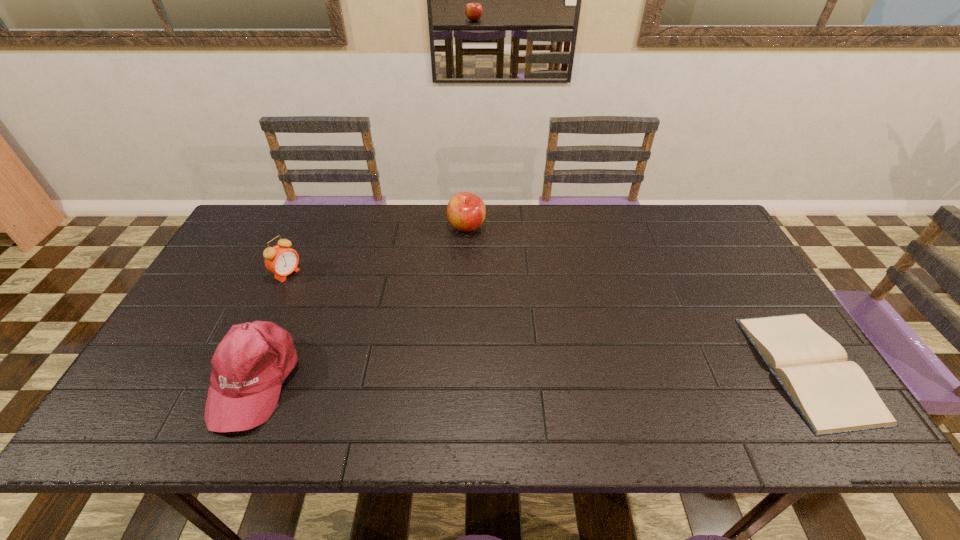
Find the location of a particular element. This screenshot has width=960, height=540. baseball cap is located at coordinates (249, 365).

Locate an element on the screen. The height and width of the screenshot is (540, 960). the rightmost object is located at coordinates (833, 395).

The height and width of the screenshot is (540, 960). I want to click on Bible, so click(x=833, y=395).

The image size is (960, 540). In order to click on the farthest object in this screenshot , I will do `click(466, 212)`.

I want to click on the second object from right to left, so click(x=466, y=212).

Locate an element on the screen. alarm clock is located at coordinates (281, 260).

Find the location of a particular element. free space located 0.180m on the left of the Bible is located at coordinates (687, 368).

Where is `free location located on the stem of the third object from left to right`? The image size is (960, 540). free location located on the stem of the third object from left to right is located at coordinates (487, 315).

Locate an element on the screen. free space located 0.180m on the stem of the third object from left to right is located at coordinates (478, 277).

Find the location of a particular element. This screenshot has width=960, height=540. vacant space located on the stem of the third object from left to right is located at coordinates (472, 251).